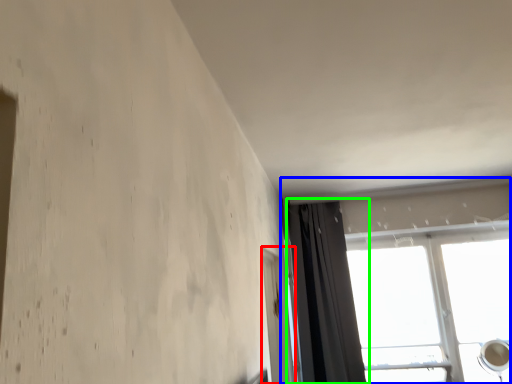
Question: Estimate the real-world distances between objects in this image. Which object is closer to screen door (highlighted by a red box), window (highlighted by a blue box) or curtain (highlighted by a green box)?

Choices:
 (A) window
 (B) curtain

Answer: (B)